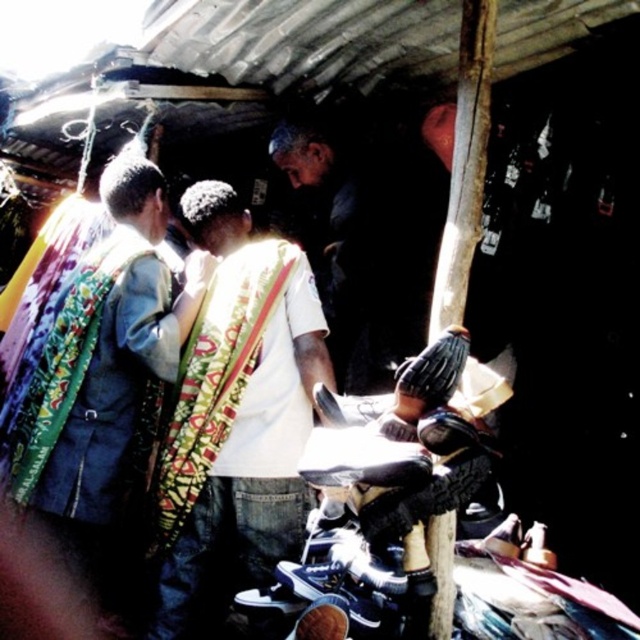
You are a customer in this shop and you want to pick up the printed fabric vest at center. However, you notice the white cotton shirt at center is blocking your view. Which item is positioned to the right of the other, making it harder to see the vest?

The white cotton shirt at center is to the right of the printed fabric vest at center, so it is blocking the view of the vest.

You are a customer looking to buy a shirt and a vest. The store has a white cotton shirt at center and a printed fabric vest at center. Which item is shorter in length?

The white cotton shirt at center is shorter than the printed fabric vest at center.

You are a customer in this shop and want to buy the printed fabric vest at center. However, the vest is currently covered by the white cotton shirt at center. How can you access the vest?

The white cotton shirt at center is in front of the printed fabric vest at center, so you can move the white cotton shirt at center aside to access the printed fabric vest at center.